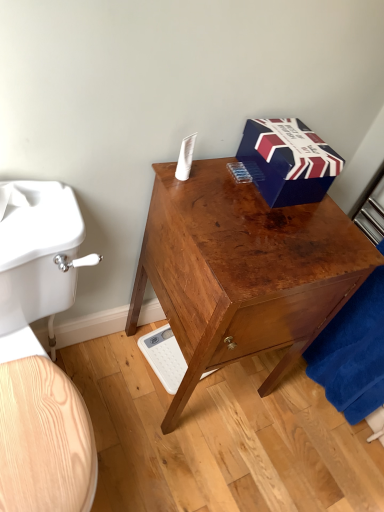
Find the location of `free space in front of white matte toilet paper at upper center`. free space in front of white matte toilet paper at upper center is located at coordinates (203, 211).